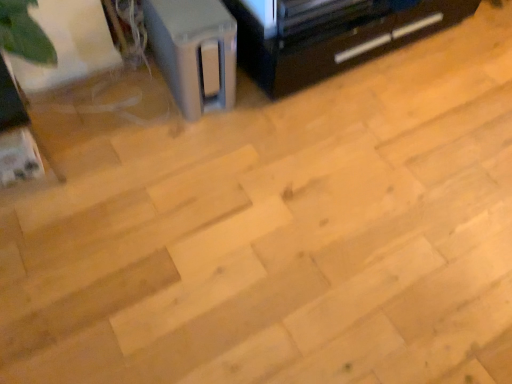
Image resolution: width=512 pixels, height=384 pixels. I want to click on vacant area that is in front of black plastic tv stand at upper right, so click(x=350, y=151).